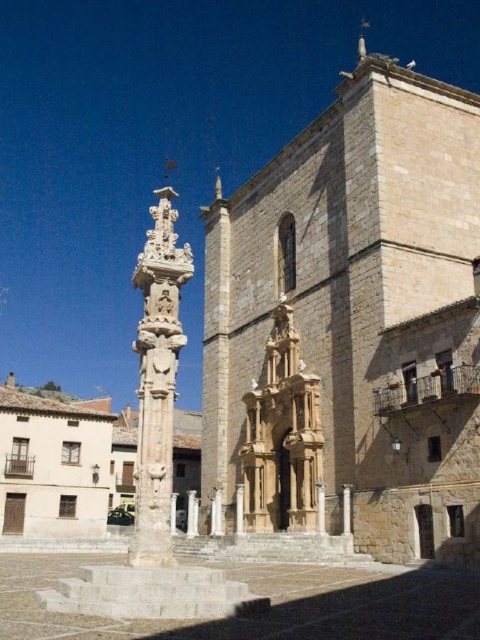
Question: Among these objects, which one is nearest to the camera?

Choices:
 (A) white stone column at center
 (B) beige stone church at center
 (C) golden stone sculpture at center

Answer: (A)

Question: Which object is positioned closest to the golden stone sculpture at center?

Choices:
 (A) light brown stone church at center
 (B) beige stone church at center
 (C) white stone column at center

Answer: (B)

Question: Does beige stone church at center have a smaller size compared to white stone column at center?

Choices:
 (A) no
 (B) yes

Answer: (A)

Question: From the image, what is the correct spatial relationship of white stone column at center in relation to golden stone sculpture at center?

Choices:
 (A) below
 (B) above

Answer: (A)

Question: Which point is closer to the camera?

Choices:
 (A) (12, 381)
 (B) (276, 365)

Answer: (B)

Question: Can you confirm if beige stone church at center is positioned below light brown stone church at center?

Choices:
 (A) yes
 (B) no

Answer: (B)